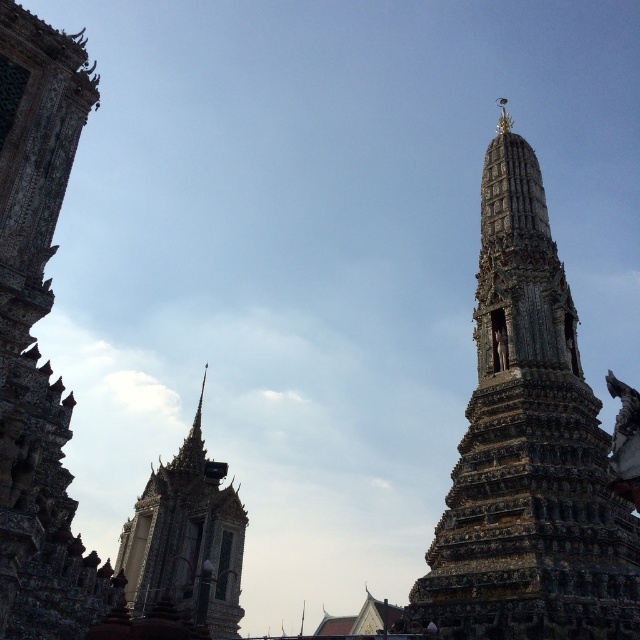
Who is more forward, [509,268] or [193,600]?

Positioned in front is point [509,268].

Find the location of `carved stone stupa at right`. carved stone stupa at right is located at coordinates (529, 449).

I want to click on carved stone stupa at right, so click(x=529, y=449).

Between carved stone stupa at right and carved stone temple at left, which one appears on the left side from the viewer's perspective?

carved stone temple at left

Between point (484, 304) and point (60, 406), which one is positioned in front?

Point (60, 406) is in front.

You are a GUI agent. You are given a task and a screenshot of the screen. Output one action in this format:
    pyautogui.click(x=<x>, y=<y>)
    Task: Click on the carved stone stupa at right
    This screenshot has height=640, width=640.
    Given the screenshot: What is the action you would take?
    pyautogui.click(x=529, y=449)

Does carved stone temple at left appear on the right side of shiny gold spire at upper left?

In fact, carved stone temple at left is to the left of shiny gold spire at upper left.

Is point (26, 420) behind point (150, 504)?

No.

This screenshot has width=640, height=640. I want to click on carved stone temple at left, so click(33, 337).